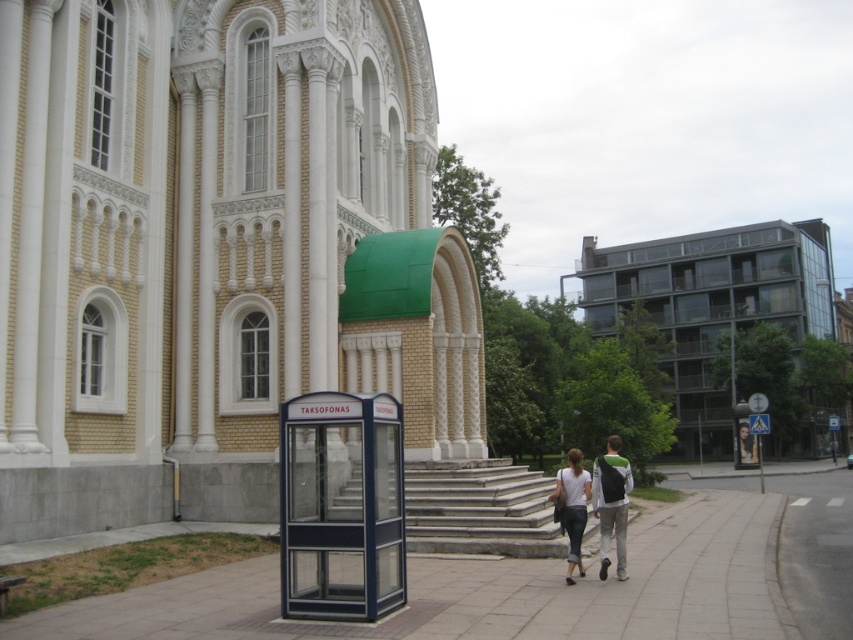
Looking at this image, you are standing at the classical building on the left and want to walk to the transparent glass building at right. What direction should you move in?

You should move to the right to reach the transparent glass building at right since it is located at point (712, 305), which is to the right side of the classical building on the left.

You are a tourist visiting this historic area and want to take a photo of both the transparent glass building at right and the stone steps at center. Since you have a limited field of view, will you need to zoom in or out to include both in your photo?

The transparent glass building at right is larger in size than stone steps at center, so you will need to zoom out to include both in your photo.

You are a tourist standing in front of the beige stone church at center and the denim pants at lower center. You want to take a photo that includes both objects. Which object should you move closer to the camera to ensure both are visible in the frame?

Since the beige stone church at center is larger in size than the denim pants at lower center, you should move the denim pants at lower center closer to the camera to balance their sizes in the photo.